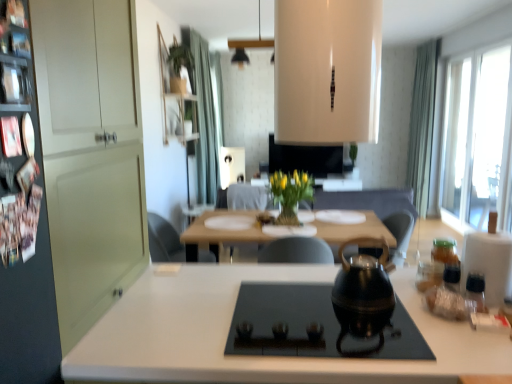
Question: Should I look upward or downward to see black glass cooktop at center?

Choices:
 (A) up
 (B) down

Answer: (B)

Question: Is black matte tea pot at center oriented away from wooden table at center?

Choices:
 (A) yes
 (B) no

Answer: (A)

Question: From a real-world perspective, is black matte tea pot at center positioned under wooden table at center based on gravity?

Choices:
 (A) yes
 (B) no

Answer: (B)

Question: Is black matte tea pot at center beside wooden table at center?

Choices:
 (A) no
 (B) yes

Answer: (A)

Question: From a real-world perspective, is black matte tea pot at center located higher than wooden table at center?

Choices:
 (A) no
 (B) yes

Answer: (B)

Question: Can you confirm if black matte tea pot at center is thinner than wooden table at center?

Choices:
 (A) no
 (B) yes

Answer: (B)

Question: Does black matte tea pot at center lie in front of wooden table at center?

Choices:
 (A) yes
 (B) no

Answer: (A)

Question: Does transparent plastic bottle at right, which ranks as the 3th bottle in back-to-front order, have a larger size compared to green fabric curtain at upper center, acting as the second curtain starting from the right?

Choices:
 (A) no
 (B) yes

Answer: (A)

Question: From a real-world perspective, is transparent plastic bottle at right, which ranks as the first bottle in front-to-back order, physically below green fabric curtain at upper center, acting as the second curtain starting from the right?

Choices:
 (A) yes
 (B) no

Answer: (A)

Question: From a real-world perspective, is transparent plastic bottle at right, which ranks as the 3th bottle in back-to-front order, over green fabric curtain at upper center, acting as the second curtain starting from the right?

Choices:
 (A) yes
 (B) no

Answer: (B)

Question: Is transparent plastic bottle at right, which ranks as the 3th bottle in back-to-front order, positioned with its back to green fabric curtain at upper center, which is counted as the first curtain, starting from the left?

Choices:
 (A) no
 (B) yes

Answer: (A)

Question: Does transparent plastic bottle at right, which ranks as the 3th bottle in back-to-front order, have a smaller size compared to green fabric curtain at upper center, acting as the second curtain starting from the right?

Choices:
 (A) no
 (B) yes

Answer: (B)

Question: From the image's perspective, does transparent plastic bottle at right, which ranks as the first bottle in front-to-back order, appear higher than green fabric curtain at upper center, acting as the second curtain starting from the right?

Choices:
 (A) yes
 (B) no

Answer: (B)

Question: Is transparent glass window at right to the right of transparent plastic jar at right, acting as the first bottle starting from the back, from the viewer's perspective?

Choices:
 (A) yes
 (B) no

Answer: (A)